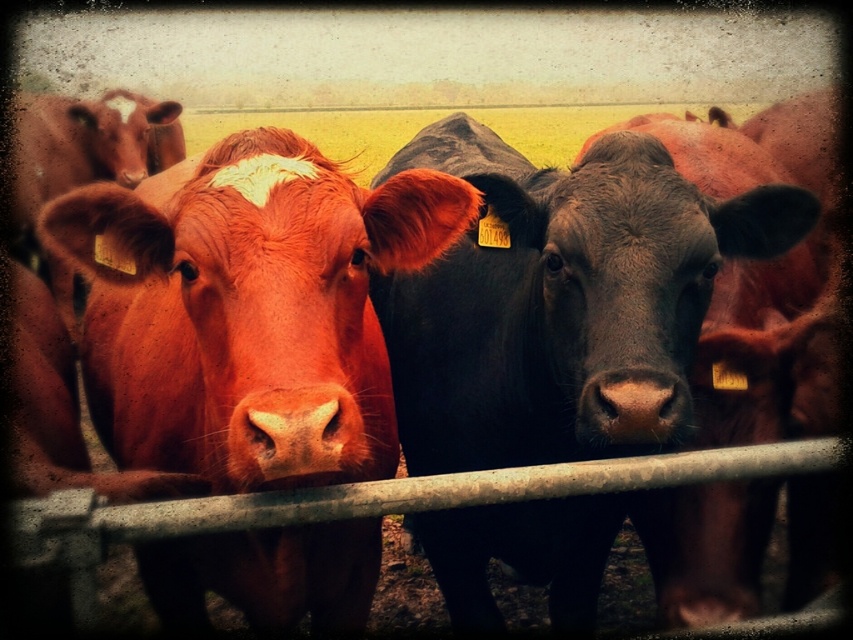
This screenshot has width=853, height=640. What do you see at coordinates (294, 433) in the screenshot?
I see `matte orange nose at center` at bounding box center [294, 433].

Where is `matte orange nose at center`? The width and height of the screenshot is (853, 640). matte orange nose at center is located at coordinates (294, 433).

The image size is (853, 640). In order to click on matte orange nose at center in this screenshot , I will do `click(294, 433)`.

At what (x,y) coordinates should I click in order to perform the action: click on matte orange nose at center. Please return your answer as a coordinate pair (x, y). This screenshot has height=640, width=853. Looking at the image, I should click on (294, 433).

Does shiny black cow at center have a lesser width compared to matte orange nose at center?

Incorrect, shiny black cow at center's width is not less than matte orange nose at center's.

Between point (635, 298) and point (309, 410), which one is positioned in front?

Point (309, 410) is in front.

Describe the element at coordinates (560, 291) in the screenshot. This screenshot has height=640, width=853. I see `shiny black cow at center` at that location.

Identify the location of shiny black cow at center. (560, 291).

Can you confirm if matte orange cow at center is bigger than matte orange nose at center?

Correct, matte orange cow at center is larger in size than matte orange nose at center.

Does matte orange cow at center appear under matte orange nose at center?

No.

This screenshot has height=640, width=853. What do you see at coordinates (248, 308) in the screenshot?
I see `matte orange cow at center` at bounding box center [248, 308].

You are a GUI agent. You are given a task and a screenshot of the screen. Output one action in this format:
    pyautogui.click(x=<x>, y=<y>)
    Task: Click on the matte orange cow at center
    This screenshot has height=640, width=853.
    Given the screenshot: What is the action you would take?
    pyautogui.click(x=248, y=308)